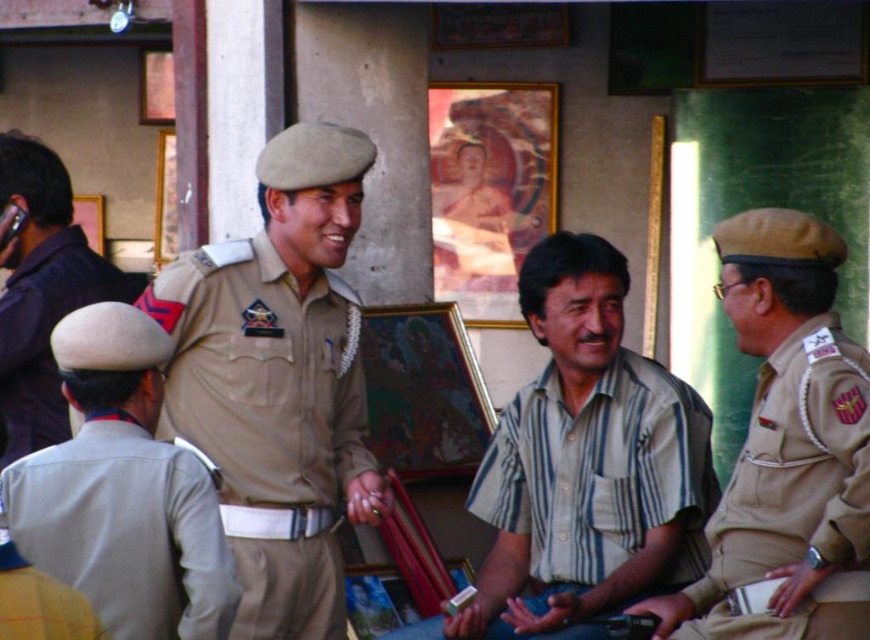
Question: Does khaki uniform at left have a smaller size compared to khaki fabric uniform at left?

Choices:
 (A) yes
 (B) no

Answer: (B)

Question: Estimate the real-world distances between objects in this image. Which object is farther from the khaki uniform at left?

Choices:
 (A) khaki fabric uniform at left
 (B) striped cotton shirt at center
 (C) matte khaki uniform at left
 (D) matte khaki uniform at right

Answer: (D)

Question: Which object appears farthest from the camera in this image?

Choices:
 (A) striped cotton shirt at center
 (B) matte khaki uniform at right
 (C) khaki fabric uniform at left

Answer: (A)

Question: Observing the image, what is the correct spatial positioning of khaki uniform at left in reference to khaki fabric uniform at left?

Choices:
 (A) right
 (B) left

Answer: (B)

Question: Is matte khaki uniform at left bigger than khaki fabric uniform at left?

Choices:
 (A) yes
 (B) no

Answer: (A)

Question: Which of the following is the closest to the observer?

Choices:
 (A) click(x=110, y=432)
 (B) click(x=253, y=362)
 (C) click(x=9, y=586)
 (D) click(x=94, y=291)

Answer: (C)